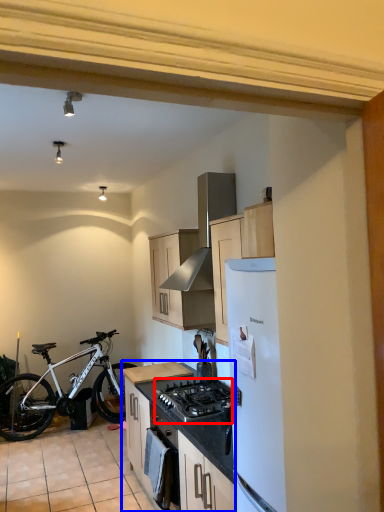
Question: Which object is further to the camera taking this photo, gas stove (highlighted by a red box) or cabinetry (highlighted by a blue box)?

Choices:
 (A) gas stove
 (B) cabinetry

Answer: (B)